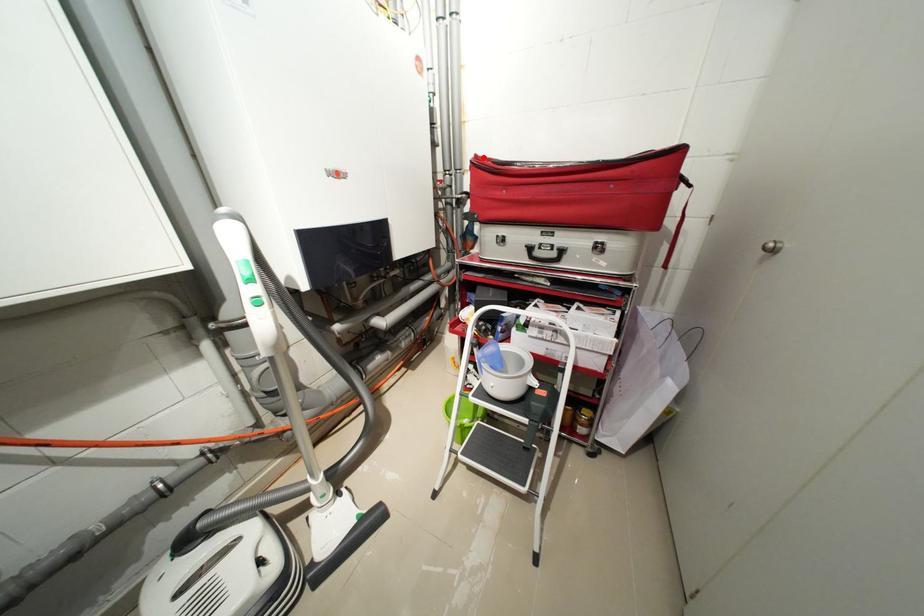
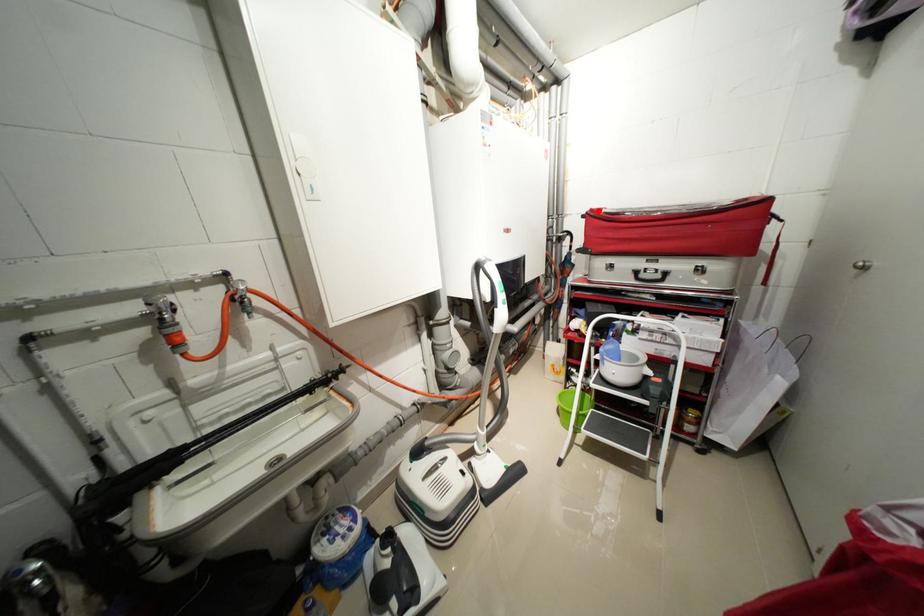
I am providing you with two images of the same scene from different viewpoints. A red point is marked on the first image and another point is marked on the second image. Do the highlighted points in image1 and image2 indicate the same real-world spot?

Yes